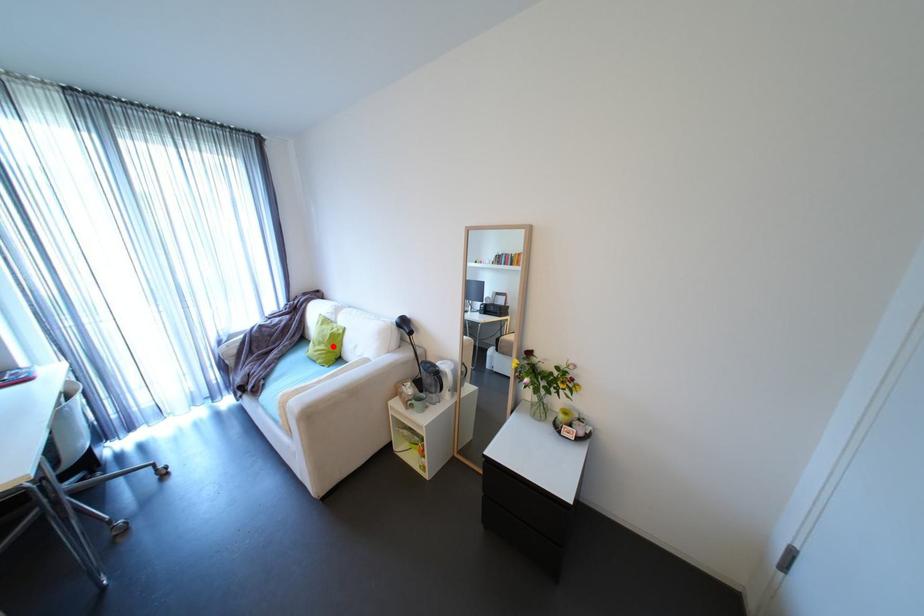
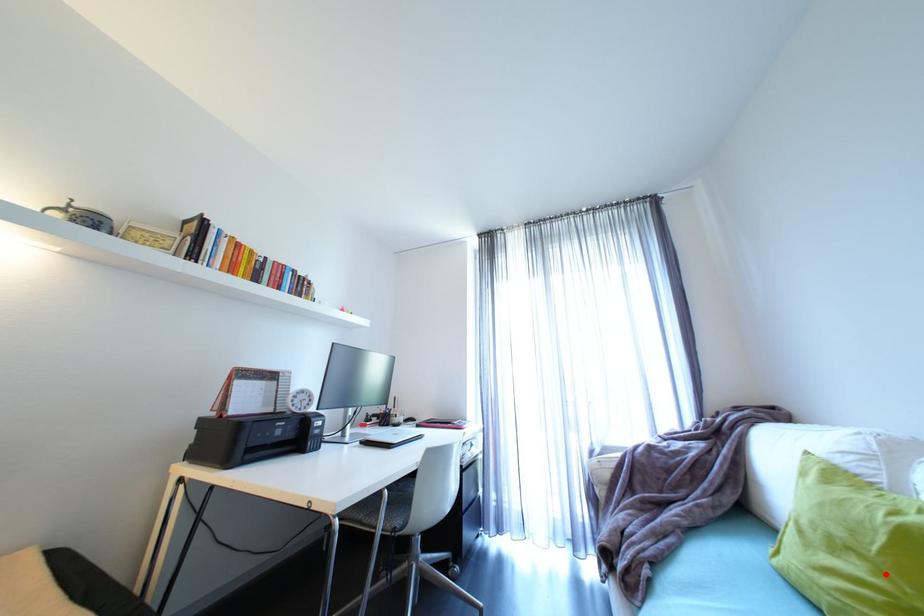
I am providing you with two images of the same scene from different viewpoints. A red point is marked on the first image and another point is marked on the second image. Is the red point in image1 aligned with the point shown in image2?

Yes